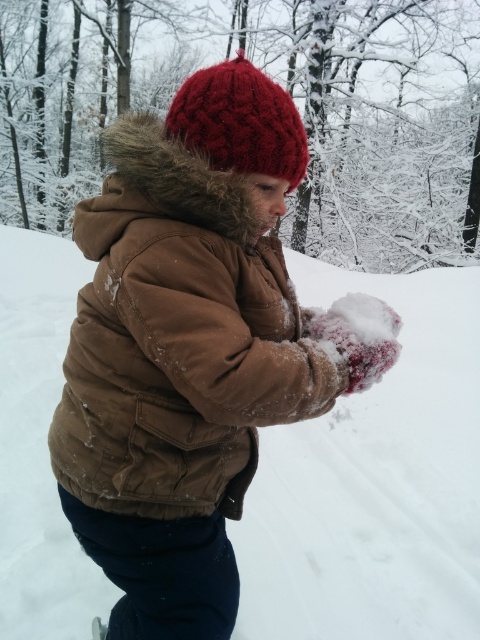
You are a fashion designer looking at the winter outfit of a person in the snowy scene. Which item of clothing, the brown cotton jacket at center or the knitted red hat at upper center, would you say is bigger in size?

The brown cotton jacket at center is larger in size compared to the knitted red hat at upper center.

You are standing in the snowy forest and want to place a small snowball exactly at the location of the white fluffy snow at center. What coordinates should you aim for?

You should aim for the coordinates point at (373, 483) to place the snowball at the location of the white fluffy snow at center.